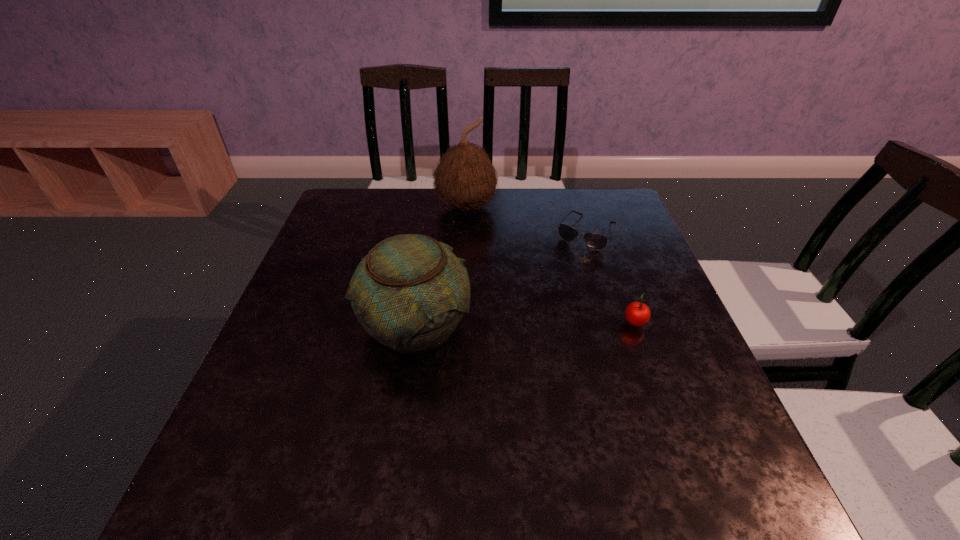
Where is `pottery`? pottery is located at coordinates (409, 293).

Locate an element on the screen. The image size is (960, 540). the third tallest object is located at coordinates (637, 314).

This screenshot has height=540, width=960. Identify the location of the shortest object. (595, 241).

You are a GUI agent. You are given a task and a screenshot of the screen. Output one action in this format:
    pyautogui.click(x=<x>, y=<y>)
    Task: Click on the coconut
    The width and height of the screenshot is (960, 540).
    Given the screenshot: What is the action you would take?
    pyautogui.click(x=465, y=178)

Locate an element on the screen. The image size is (960, 540). free space located 0.050m on the left of the second tallest object is located at coordinates 337,325.

At what (x,y) coordinates should I click in order to perform the action: click on blank space located on the back of the second shortest object. Please return your answer as a coordinate pair (x, y). The image size is (960, 540). Looking at the image, I should click on (613, 265).

The image size is (960, 540). Find the location of `free region located on the front-facing side of the sunglasses`. free region located on the front-facing side of the sunglasses is located at coordinates (564, 266).

Image resolution: width=960 pixels, height=540 pixels. Identify the location of free space located 0.270m on the front-facing side of the sunglasses. (537, 313).

Where is `free space located 0.320m on the front-facing side of the sunglasses`? Image resolution: width=960 pixels, height=540 pixels. free space located 0.320m on the front-facing side of the sunglasses is located at coordinates tap(528, 327).

Identify the location of free space located on the surface of the tallest object. (488, 288).